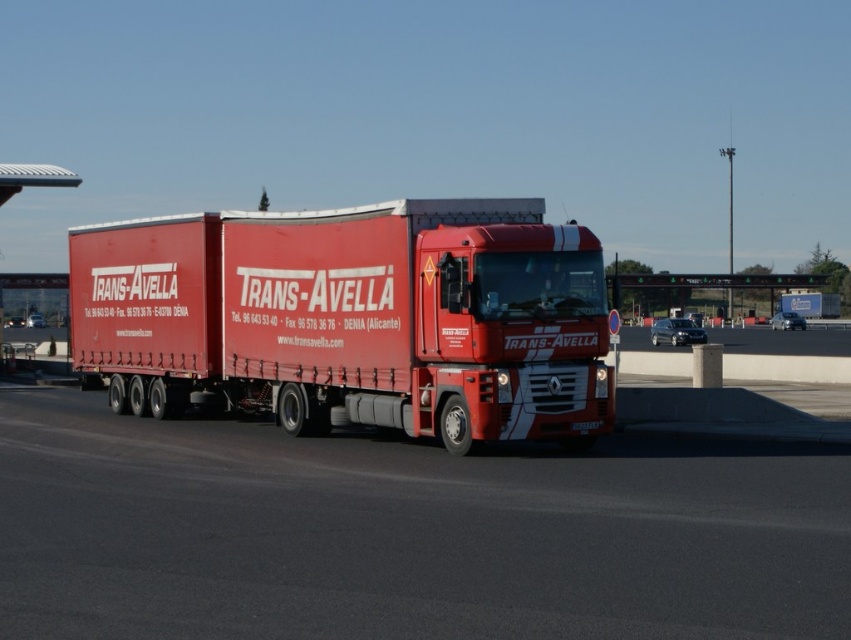
Looking at this image, you are a delivery driver who needs to park your vehicle in a parking spot that is 2.5 meters wide. You have a matte red trailer truck at center and a matte red truck at center. Which vehicle should you choose to fit into the parking spot?

The matte red trailer truck at center has a width less than the matte red truck at center, so the matte red trailer truck at center is narrower and will fit into the 2.5 meters wide parking spot better than the matte red truck at center.

You are a delivery driver who needs to pass under a low bridge that has a height restriction of 3.5 meters. You are currently driving the matte red truck at center and see the matte red trailer truck at center behind you. Which vehicle should you be more concerned about fitting under the bridge?

The matte red trailer truck at center is much taller than the matte red truck at center, so you should be more concerned about the matte red trailer truck at center fitting under the bridge since it exceeds the height restriction of 3.5 meters.